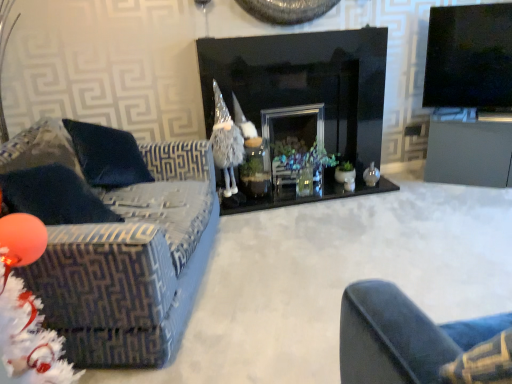
Question: Would you say black glass fireplace at center contains black glossy tv at upper right?

Choices:
 (A) yes
 (B) no

Answer: (B)

Question: Can you confirm if black glass fireplace at center is wider than black glossy tv at upper right?

Choices:
 (A) yes
 (B) no

Answer: (A)

Question: From a real-world perspective, is black glass fireplace at center on top of black glossy tv at upper right?

Choices:
 (A) no
 (B) yes

Answer: (A)

Question: Is black glass fireplace at center facing away from black glossy tv at upper right?

Choices:
 (A) no
 (B) yes

Answer: (A)

Question: Is there a large distance between black glass fireplace at center and black glossy tv at upper right?

Choices:
 (A) no
 (B) yes

Answer: (A)

Question: Would you say velvet-patterned couch at left is inside or outside translucent glass vase at center?

Choices:
 (A) inside
 (B) outside

Answer: (B)

Question: Looking at their shapes, would you say velvet-patterned couch at left is wider or thinner than translucent glass vase at center?

Choices:
 (A) wide
 (B) thin

Answer: (A)

Question: Considering their positions, is velvet-patterned couch at left located in front of or behind translucent glass vase at center?

Choices:
 (A) front
 (B) behind

Answer: (A)

Question: From a real-world perspective, is velvet-patterned couch at left physically located above or below translucent glass vase at center?

Choices:
 (A) above
 (B) below

Answer: (A)

Question: Is point (440, 153) positioned closer to the camera than point (478, 44)?

Choices:
 (A) closer
 (B) farther

Answer: (B)

Question: Would you say matte gray table at right is inside or outside black glossy tv at upper right?

Choices:
 (A) outside
 (B) inside

Answer: (A)

Question: From a real-world perspective, is matte gray table at right above or below black glossy tv at upper right?

Choices:
 (A) above
 (B) below

Answer: (B)

Question: Is matte gray table at right bigger or smaller than black glossy tv at upper right?

Choices:
 (A) small
 (B) big

Answer: (B)

Question: From the image's perspective, is black glossy tv at upper right located above or below velvet-patterned couch at left?

Choices:
 (A) above
 (B) below

Answer: (A)

Question: From a real-world perspective, is black glossy tv at upper right above or below velvet-patterned couch at left?

Choices:
 (A) above
 (B) below

Answer: (A)